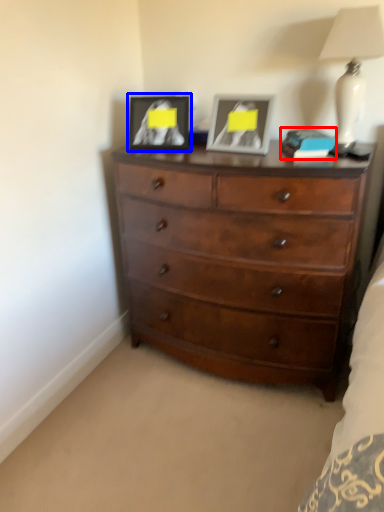
Question: Which point is further to the camera, book (highlighted by a red box) or picture frame (highlighted by a blue box)?

Choices:
 (A) book
 (B) picture frame

Answer: (B)